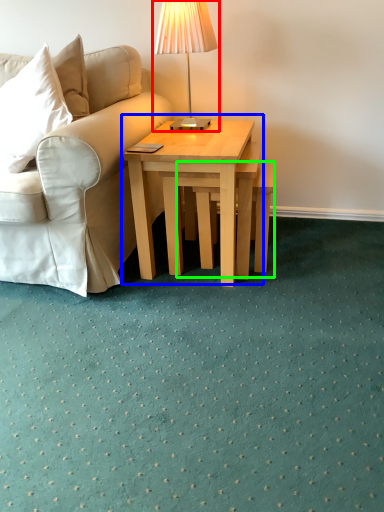
Question: Considering the real-world distances, which object is farthest from table lamp (highlighted by a red box)? coffee table (highlighted by a blue box) or stool (highlighted by a green box)?

Choices:
 (A) coffee table
 (B) stool

Answer: (B)